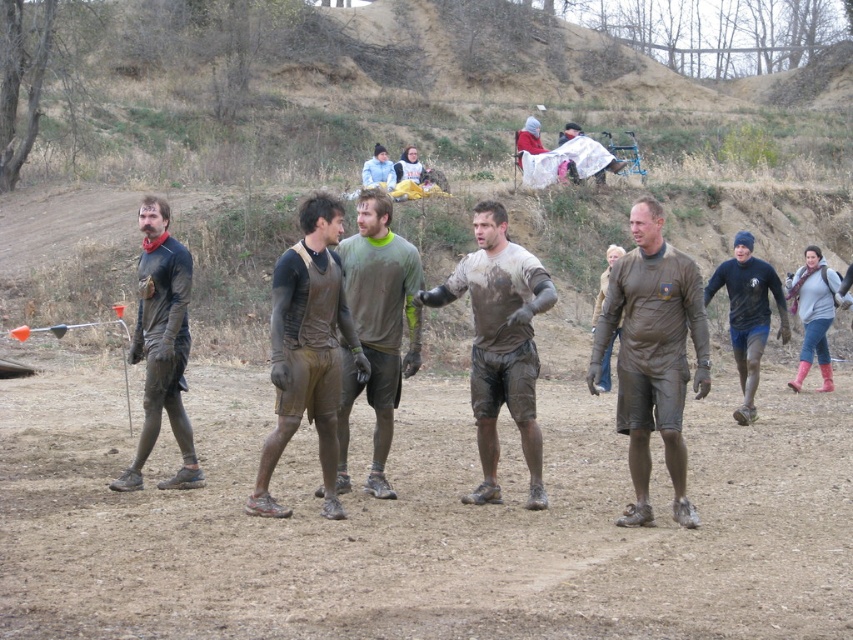
Question: Which point is closer to the camera taking this photo?

Choices:
 (A) (144, 342)
 (B) (639, 426)
 (C) (759, 305)

Answer: (B)

Question: In this image, where is muddy cotton shirt at center located relative to light blue fabric at center?

Choices:
 (A) above
 (B) below

Answer: (B)

Question: Which object appears farthest from the camera in this image?

Choices:
 (A) light blue fabric at center
 (B) muddy uniform at center
 (C) matte black outfit at left
 (D) dark blue jersey at right

Answer: (A)

Question: Is muddy rubber shorts at center wider than muddy rubber boots at center?

Choices:
 (A) no
 (B) yes

Answer: (B)

Question: Which point is closer to the camera?

Choices:
 (A) light blue fabric at center
 (B) dark blue jersey at right
 (C) muddy uniform at center
 (D) brown muddy ground at center

Answer: (D)

Question: Is the position of muddy cotton shirt at center more distant than that of light blue fabric at center?

Choices:
 (A) yes
 (B) no

Answer: (B)